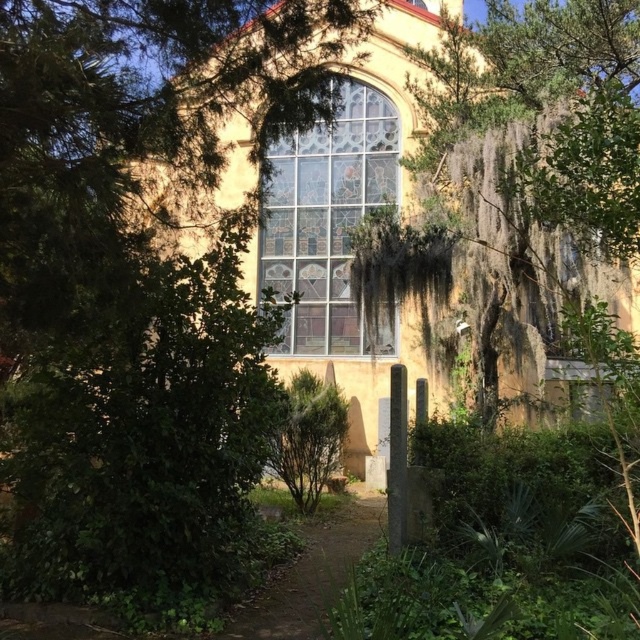
Can you confirm if yellow stucco church at center is taller than brown dirt path at center?

Yes.

Describe the element at coordinates (465, 193) in the screenshot. The width and height of the screenshot is (640, 640). I see `yellow stucco church at center` at that location.

Find the location of a particular element. This screenshot has width=640, height=640. yellow stucco church at center is located at coordinates (465, 193).

What do you see at coordinates (465, 193) in the screenshot? Image resolution: width=640 pixels, height=640 pixels. I see `yellow stucco church at center` at bounding box center [465, 193].

This screenshot has width=640, height=640. What do you see at coordinates (465, 193) in the screenshot? I see `yellow stucco church at center` at bounding box center [465, 193].

Where is `yellow stucco church at center`? The height and width of the screenshot is (640, 640). yellow stucco church at center is located at coordinates (465, 193).

Is stained glass window at center thinner than brown dirt path at center?

Incorrect, stained glass window at center's width is not less than brown dirt path at center's.

Is stained glass window at center shorter than brown dirt path at center?

No.

Which is behind, point (381, 317) or point (285, 621)?

The point (381, 317) is behind.

Identify the location of stained glass window at center. The height and width of the screenshot is (640, 640). (328, 224).